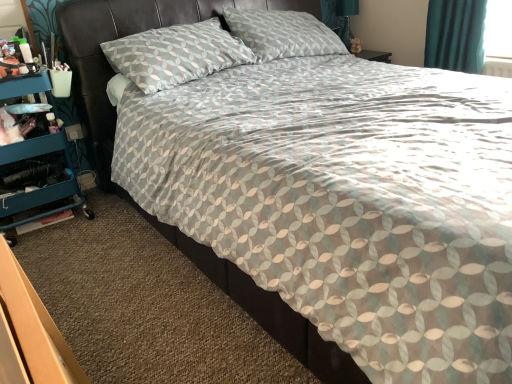
Question: From the image's perspective, is teal fabric curtain at upper right positioned above or below teal plastic cart at left?

Choices:
 (A) above
 (B) below

Answer: (A)

Question: From a real-world perspective, is teal fabric curtain at upper right above or below teal plastic cart at left?

Choices:
 (A) above
 (B) below

Answer: (A)

Question: Considering the positions of teal fabric curtain at upper right and teal plastic cart at left in the image, is teal fabric curtain at upper right wider or thinner than teal plastic cart at left?

Choices:
 (A) thin
 (B) wide

Answer: (A)

Question: Is teal plastic cart at left inside or outside of teal fabric curtain at upper right?

Choices:
 (A) inside
 (B) outside

Answer: (B)

Question: Does point (32, 203) appear closer or farther from the camera than point (480, 34)?

Choices:
 (A) closer
 (B) farther

Answer: (A)

Question: Considering their positions, is teal plastic cart at left located in front of or behind teal fabric curtain at upper right?

Choices:
 (A) front
 (B) behind

Answer: (A)

Question: Considering the relative positions of teal plastic cart at left and teal fabric curtain at upper right in the image provided, is teal plastic cart at left to the left or to the right of teal fabric curtain at upper right?

Choices:
 (A) left
 (B) right

Answer: (A)